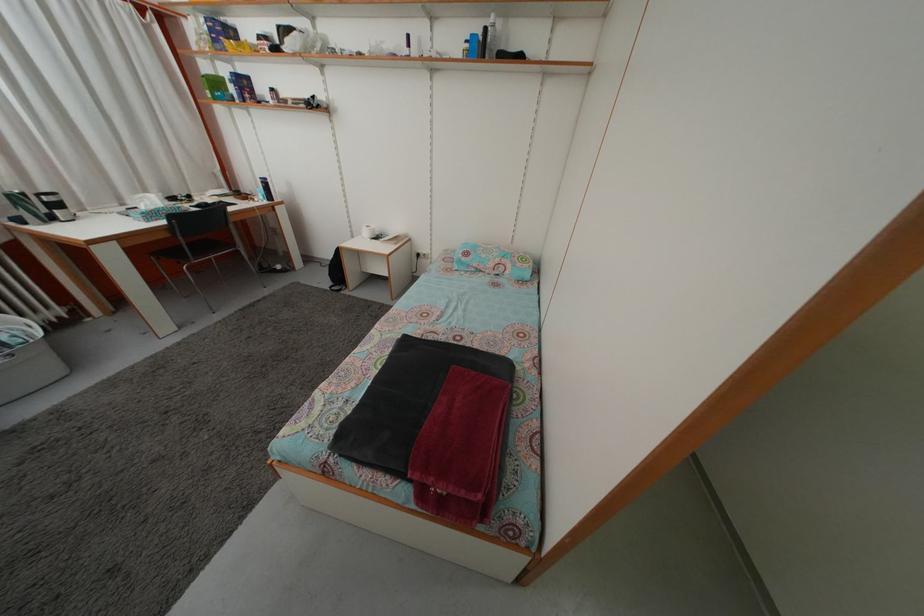
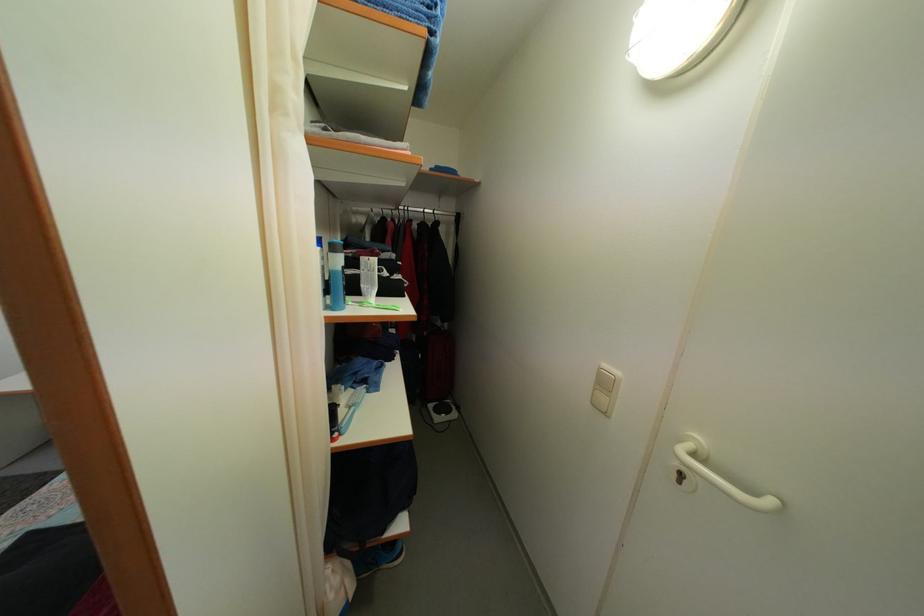
Question: The camera is either moving clockwise (left) or counter-clockwise (right) around the object. The first image is from the beginning of the video and the second image is from the end. Is the camera moving left or right when shooting the video?

Choices:
 (A) Left
 (B) Right

Answer: (A)